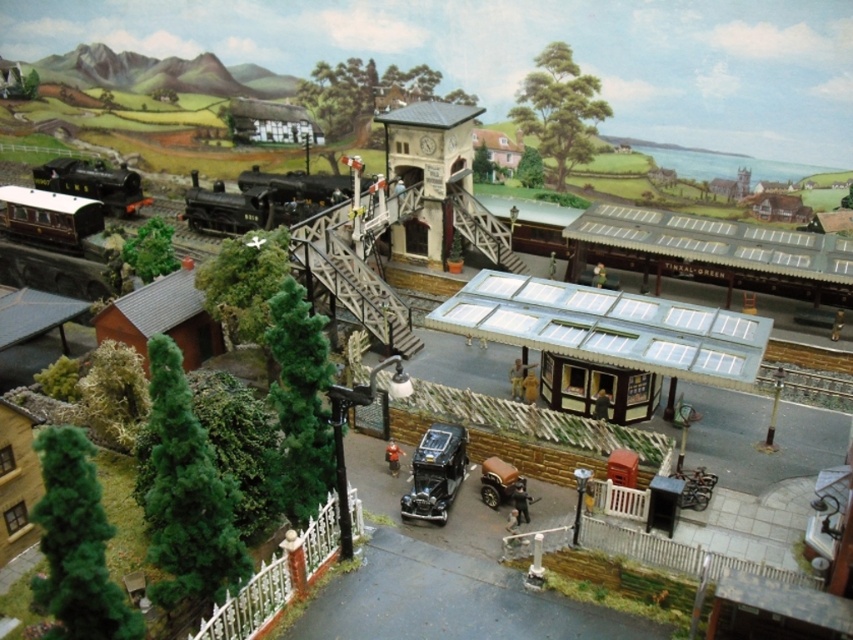
You are a passenger waiting at the station platform. You see a black polished wood train at center and a shiny black car at center. Which one is closer to the left side of the platform?

The black polished wood train at center is closer to the left side of the platform since it is positioned to the left of the shiny black car at center.

You are a photographer standing at the camera position in the model railway scene. You want to take a photo that includes both point (28, 212) and point (450, 458). Which point will appear closer to the front of the photo?

Point (28, 212) is further to the camera than point (450, 458), so in the photo, point (28, 212) will appear closer to the front of the photo.

Consider the image. You are a toy collector who wants to display both the black polished wood train at center and the shiny black car at center on a shelf. The shelf has a maximum width capacity of 1.2 meters. If the train is wider than the car, can both items be placed on the shelf without exceeding the width limit?

The black polished wood train at center is wider than the shiny black car at center. However, since the exact widths are not provided, it is impossible to determine if their combined width exceeds the shelf capacity. More information about their individual dimensions is needed to ensure they fit within the 1.2 meters limit.